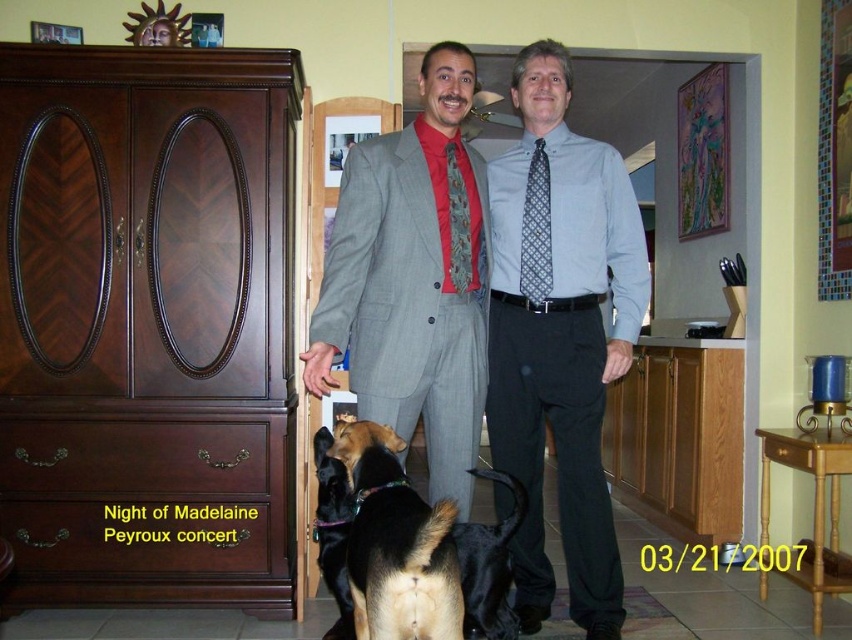
Question: Which object is positioned farthest from the black fur dog at lower center?

Choices:
 (A) black fur dog at center
 (B) red silk tie at center

Answer: (B)

Question: Is dark wood armoire at left positioned before black fur dog at lower center?

Choices:
 (A) no
 (B) yes

Answer: (A)

Question: Which is nearer to the black fur dog at lower center?

Choices:
 (A) blue patterned tie at center
 (B) brown fur dog at center
 (C) light blue shirt at center

Answer: (B)

Question: Does dark wood armoire at left appear on the right side of red silk tie at center?

Choices:
 (A) no
 (B) yes

Answer: (A)

Question: Which object is closer to the camera taking this photo?

Choices:
 (A) light blue shirt at center
 (B) dark wood armoire at left

Answer: (A)

Question: From the image, what is the correct spatial relationship of brown fur dog at center in relation to red silk tie at center?

Choices:
 (A) above
 (B) below

Answer: (B)